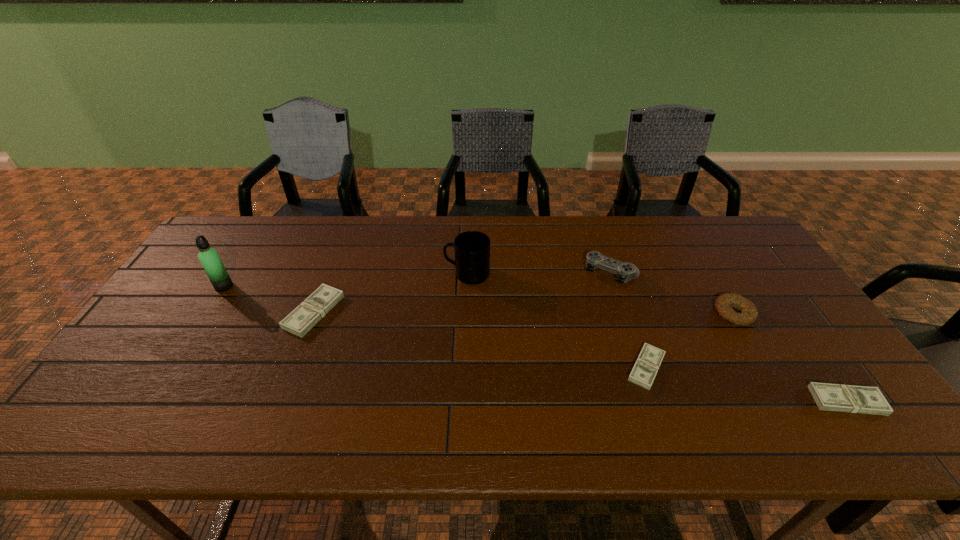
Find the location of `free space that satisfies the following two spatial constraints: 1. on the back side of the rightmost money; 2. on the side of the second tallest object with the handle`. free space that satisfies the following two spatial constraints: 1. on the back side of the rightmost money; 2. on the side of the second tallest object with the handle is located at coordinates (757, 274).

You are a GUI agent. You are given a task and a screenshot of the screen. Output one action in this format:
    pyautogui.click(x=<x>, y=<y>)
    Task: Click on the free point that satisfies the following two spatial constraints: 1. on the back side of the second shortest money; 2. on the side of the sixth shortest object with the handle
    This screenshot has height=540, width=960.
    Given the screenshot: What is the action you would take?
    pyautogui.click(x=757, y=274)